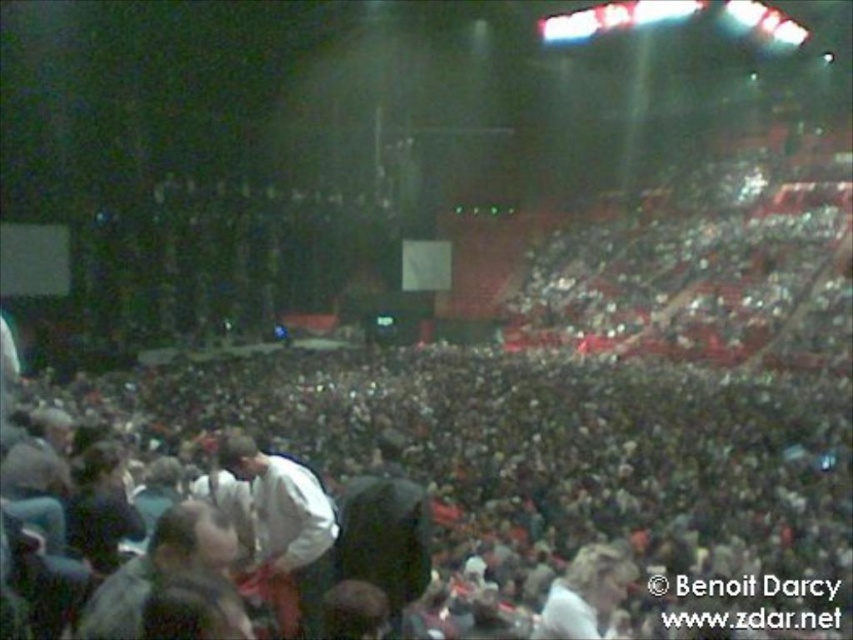
You are standing at the center of the arena and want to locate the white matte shirt at lower left. According to the arena layout, where should you look relative to your current position?

The white matte shirt at lower left is located at coordinates point 0.833 on the x axis and 0.334 on the y axis, so you should look towards the lower left direction from your current position at the center of the arena.

You are a photographer positioned at the back of the arena, aiming to capture a clear shot of the stage. However, you notice two items blocking your view slightly. Which object, the white matte shirt at lower left or the dark gray fabric jacket at center, is closer to your camera lens and thus more obstructive?

The white matte shirt at lower left is above the dark gray fabric jacket at center, meaning it is closer to your camera lens and therefore more obstructive.

You are at the back of the arena and want to take a photo of the stage. There are two points in your viewfinder labeled as point 1 at coordinates point (268, 579) and point 2 at coordinates point (543, 637). Which point should you focus on to ensure the stage is in focus?

You should focus on point 1 at coordinates point (268, 579) because it is closer to the camera than point 2 at coordinates point (543, 637), ensuring better focus on the stage.